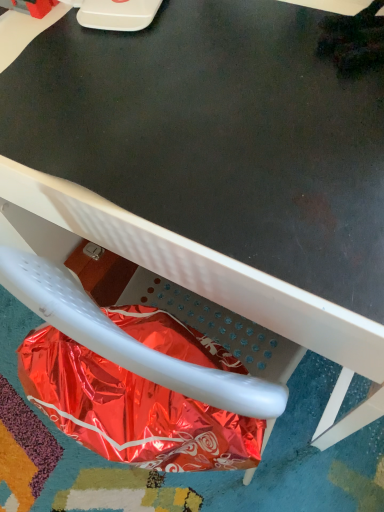
This screenshot has height=512, width=384. In order to click on metallic white chair at lower center in this screenshot , I will do `click(171, 280)`.

The image size is (384, 512). What do you see at coordinates (171, 280) in the screenshot?
I see `metallic white chair at lower center` at bounding box center [171, 280].

This screenshot has width=384, height=512. What do you see at coordinates (131, 411) in the screenshot?
I see `shiny metallic bag at lower left` at bounding box center [131, 411].

Where is `shiny metallic bag at lower left`? This screenshot has width=384, height=512. shiny metallic bag at lower left is located at coordinates (131, 411).

Measure the distance between point (193, 463) and camera.

Point (193, 463) is 22.44 inches from camera.

At what (x,y) coordinates should I click in order to perform the action: click on metallic white chair at lower center. Please return your answer as a coordinate pair (x, y). This screenshot has height=512, width=384. Looking at the image, I should click on (171, 280).

Which is more to the right, shiny metallic bag at lower left or metallic white chair at lower center?

metallic white chair at lower center.

Relative to metallic white chair at lower center, is shiny metallic bag at lower left in front or behind?

shiny metallic bag at lower left is behind metallic white chair at lower center.

Is point (108, 405) more distant than point (86, 213)?

No, it is not.

From the image's perspective, between shiny metallic bag at lower left and metallic white chair at lower center, who is located below?

shiny metallic bag at lower left appears lower in the image.

From a real-world perspective, is shiny metallic bag at lower left under metallic white chair at lower center?

No, from a real-world perspective, shiny metallic bag at lower left is not below metallic white chair at lower center.

Which of these two, shiny metallic bag at lower left or metallic white chair at lower center, is thinner?

With smaller width is shiny metallic bag at lower left.

Is shiny metallic bag at lower left shorter than metallic white chair at lower center?

Yes.

Can you confirm if shiny metallic bag at lower left is bigger than metallic white chair at lower center?

Incorrect, shiny metallic bag at lower left is not larger than metallic white chair at lower center.

Can we say shiny metallic bag at lower left lies outside metallic white chair at lower center?

That's correct, shiny metallic bag at lower left is outside of metallic white chair at lower center.

Are shiny metallic bag at lower left and metallic white chair at lower center beside each other?

No, shiny metallic bag at lower left is not next to metallic white chair at lower center.

Could you tell me if shiny metallic bag at lower left is facing metallic white chair at lower center?

No, shiny metallic bag at lower left does not turn towards metallic white chair at lower center.

Measure the distance between shiny metallic bag at lower left and metallic white chair at lower center.

shiny metallic bag at lower left and metallic white chair at lower center are 5.27 inches apart from each other.

Image resolution: width=384 pixels, height=512 pixels. Find the location of `chair lying in front of the shiny metallic bag at lower left`. chair lying in front of the shiny metallic bag at lower left is located at coordinates (171, 280).

Based on their positions, is metallic white chair at lower center located to the left or right of shiny metallic bag at lower left?

Clearly, metallic white chair at lower center is on the right of shiny metallic bag at lower left in the image.

Is metallic white chair at lower center in front of shiny metallic bag at lower left?

Yes, metallic white chair at lower center is in front of shiny metallic bag at lower left.

Is point (374, 357) closer or farther from the camera than point (202, 438)?

Point (374, 357) is positioned closer to the camera compared to point (202, 438).

From the image's perspective, is metallic white chair at lower center under shiny metallic bag at lower left?

Incorrect, from the image's perspective, metallic white chair at lower center is higher than shiny metallic bag at lower left.

Looking at this image, from a real-world perspective, relative to shiny metallic bag at lower left, is metallic white chair at lower center vertically above or below?

Clearly, from a real-world perspective, metallic white chair at lower center is below shiny metallic bag at lower left.

Does metallic white chair at lower center have a greater width compared to shiny metallic bag at lower left?

Correct, the width of metallic white chair at lower center exceeds that of shiny metallic bag at lower left.

Does metallic white chair at lower center have a greater height compared to shiny metallic bag at lower left?

Indeed, metallic white chair at lower center has a greater height compared to shiny metallic bag at lower left.

Who is bigger, metallic white chair at lower center or shiny metallic bag at lower left?

metallic white chair at lower center is bigger.

Is metallic white chair at lower center spatially inside shiny metallic bag at lower left, or outside of it?

metallic white chair at lower center is spatially situated outside shiny metallic bag at lower left.

Is there a large distance between metallic white chair at lower center and shiny metallic bag at lower left?

metallic white chair at lower center is near shiny metallic bag at lower left, not far away.

Is metallic white chair at lower center facing away from shiny metallic bag at lower left?

Absolutely, metallic white chair at lower center is directed away from shiny metallic bag at lower left.

How different are the orientations of metallic white chair at lower center and shiny metallic bag at lower left in degrees?

They differ by 180 degrees in their facing directions.

Find the location of `paper bag below the metallic white chair at lower center (from the image's perspective)`. paper bag below the metallic white chair at lower center (from the image's perspective) is located at coordinates (131, 411).

This screenshot has width=384, height=512. I want to click on chair on the right of the shiny metallic bag at lower left, so click(171, 280).

Locate an element on the screen. The width and height of the screenshot is (384, 512). chair located in front of the shiny metallic bag at lower left is located at coordinates (171, 280).